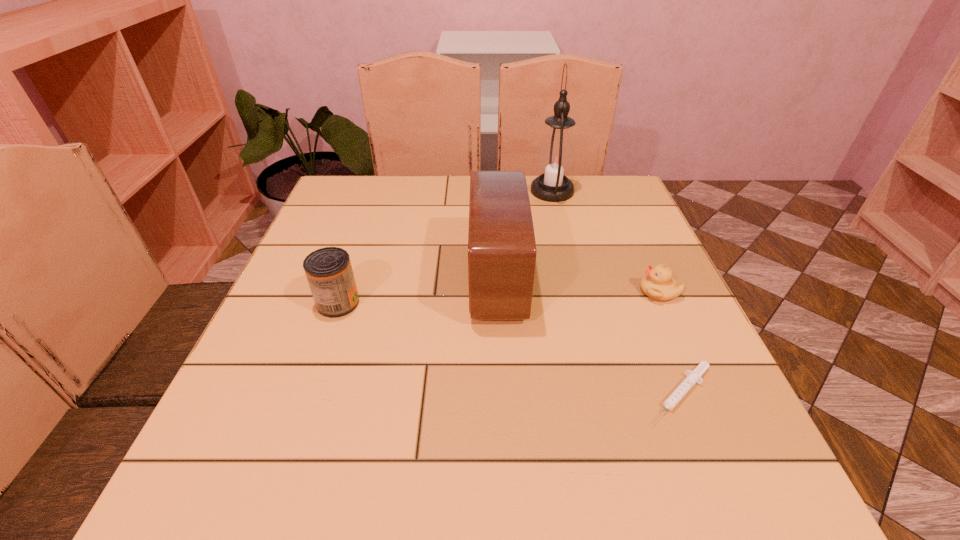
In order to click on the farthest object in this screenshot , I will do `click(556, 158)`.

This screenshot has height=540, width=960. In order to click on oil lamp in this screenshot , I will do `click(556, 158)`.

Locate an element on the screen. This screenshot has height=540, width=960. radio receiver is located at coordinates (501, 241).

Identify the location of the fourth object from right to left. The width and height of the screenshot is (960, 540). (501, 241).

Image resolution: width=960 pixels, height=540 pixels. Find the location of `the leftmost object`. the leftmost object is located at coordinates (329, 273).

Find the location of a particular element. Image resolution: width=960 pixels, height=540 pixels. the third shortest object is located at coordinates (329, 273).

Where is `duckling`? This screenshot has width=960, height=540. duckling is located at coordinates (658, 284).

Locate an element on the screen. The image size is (960, 540). syringe is located at coordinates (693, 377).

In order to click on the shortest object in this screenshot , I will do `click(693, 377)`.

Where is `vacant space located 0.120m on the front of the tallest object`? The image size is (960, 540). vacant space located 0.120m on the front of the tallest object is located at coordinates (562, 231).